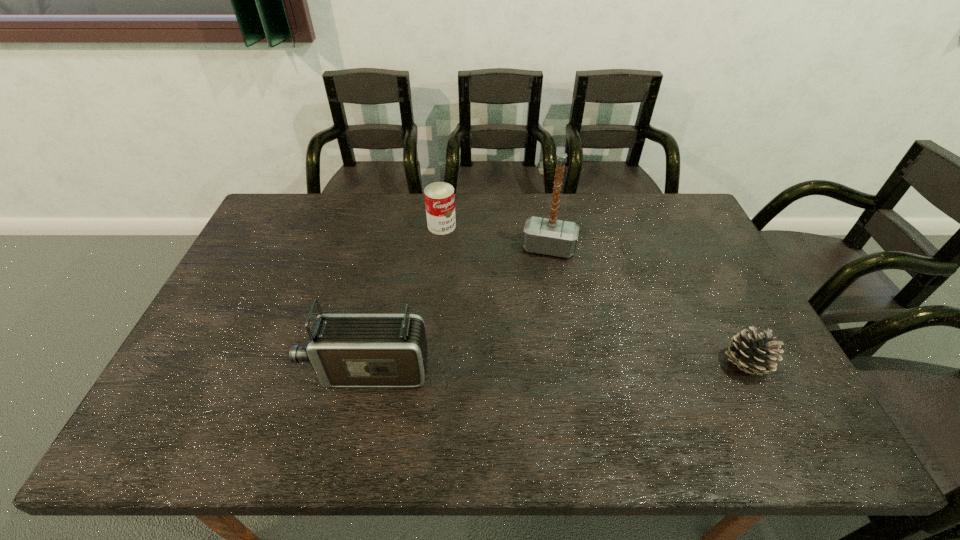
At what (x,y) coordinates should I click in order to perform the action: click on object at the right edge. Please return your answer as a coordinate pair (x, y). The height and width of the screenshot is (540, 960). Looking at the image, I should click on (753, 354).

Where is `object positioned at the near right corner`? This screenshot has width=960, height=540. object positioned at the near right corner is located at coordinates (753, 354).

This screenshot has height=540, width=960. What are the coordinates of `free location at the far edge` in the screenshot? It's located at (546, 214).

At what (x,y) coordinates should I click in order to perform the action: click on free region at the near edge. Please return your answer as a coordinate pair (x, y). This screenshot has width=960, height=540. Looking at the image, I should click on (295, 406).

This screenshot has width=960, height=540. In order to click on vacant space at the left edge of the desktop in this screenshot , I will do `click(282, 282)`.

The image size is (960, 540). Identify the location of vacant space at the right edge of the desktop. (732, 294).

You are a GUI agent. You are given a task and a screenshot of the screen. Output one action in this format:
    pyautogui.click(x=<x>, y=<y>)
    Task: Click on the vacant space at the far left corner of the desktop
    This screenshot has height=540, width=960.
    Given the screenshot: What is the action you would take?
    pyautogui.click(x=304, y=215)

Where is `free space at the near left corner`? The width and height of the screenshot is (960, 540). free space at the near left corner is located at coordinates (220, 387).

At what (x,y) coordinates should I click in order to perform the action: click on free location at the far right corner. Please return your answer as a coordinate pair (x, y). This screenshot has height=540, width=960. Looking at the image, I should click on (652, 211).

This screenshot has width=960, height=540. In the image, there is a desktop. What are the coordinates of `vacant area at the near right corner` in the screenshot? It's located at (780, 382).